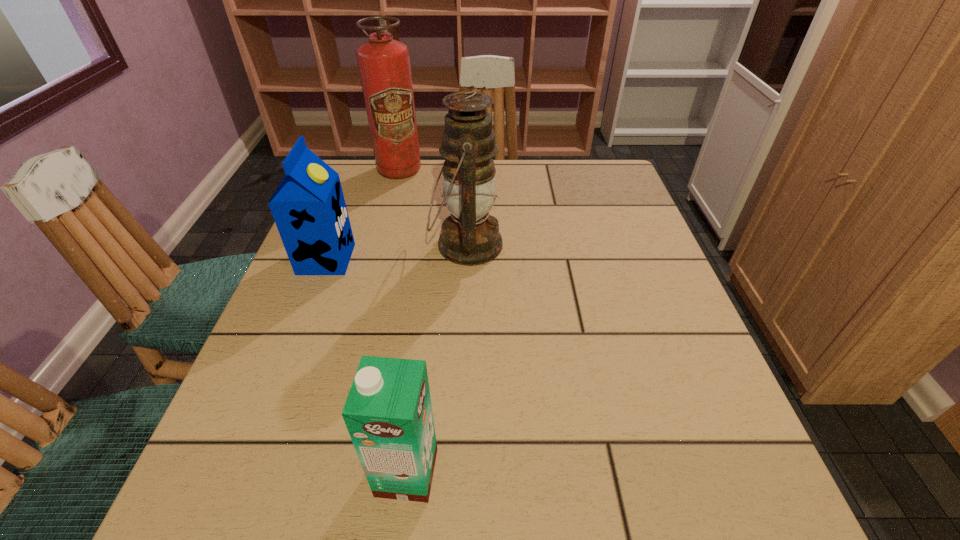
The width and height of the screenshot is (960, 540). In order to click on the farthest object in this screenshot , I will do `click(384, 65)`.

Identify the location of lantern. This screenshot has height=540, width=960. (470, 236).

Locate an element on the screen. The image size is (960, 540). the left carton is located at coordinates (308, 207).

Where is `the nearest object`? The height and width of the screenshot is (540, 960). the nearest object is located at coordinates (388, 413).

You are a GUI agent. You are given a task and a screenshot of the screen. Output one action in this format:
    pyautogui.click(x=<x>, y=<y>)
    Task: Click on the right carton
    This screenshot has height=540, width=960.
    Given the screenshot: What is the action you would take?
    pyautogui.click(x=388, y=413)

Locate an element on the screen. This screenshot has height=540, width=960. vacant space located on the label side of the fire extinguisher is located at coordinates (386, 222).

This screenshot has width=960, height=540. Identify the location of blank space located 0.150m on the left of the lantern. (366, 245).

At what (x,y) coordinates should I click in order to perform the action: click on vacant region located with the cap open on the left carton. Please return your answer as a coordinate pair (x, y). This screenshot has height=540, width=960. Looking at the image, I should click on (485, 259).

In order to click on free spot located 0.260m on the left of the right carton in this screenshot , I will do `click(199, 472)`.

You are a GUI agent. You are given a task and a screenshot of the screen. Output one action in this format:
    pyautogui.click(x=<x>, y=<y>)
    Task: Click on the object located in the far edge section of the desktop
    Image resolution: width=960 pixels, height=540 pixels.
    Given the screenshot: What is the action you would take?
    pyautogui.click(x=384, y=65)